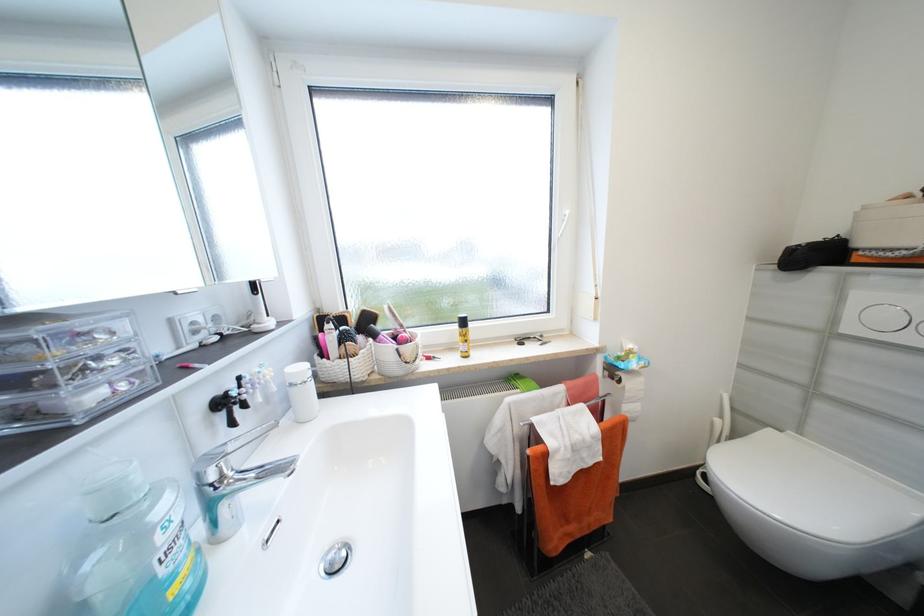
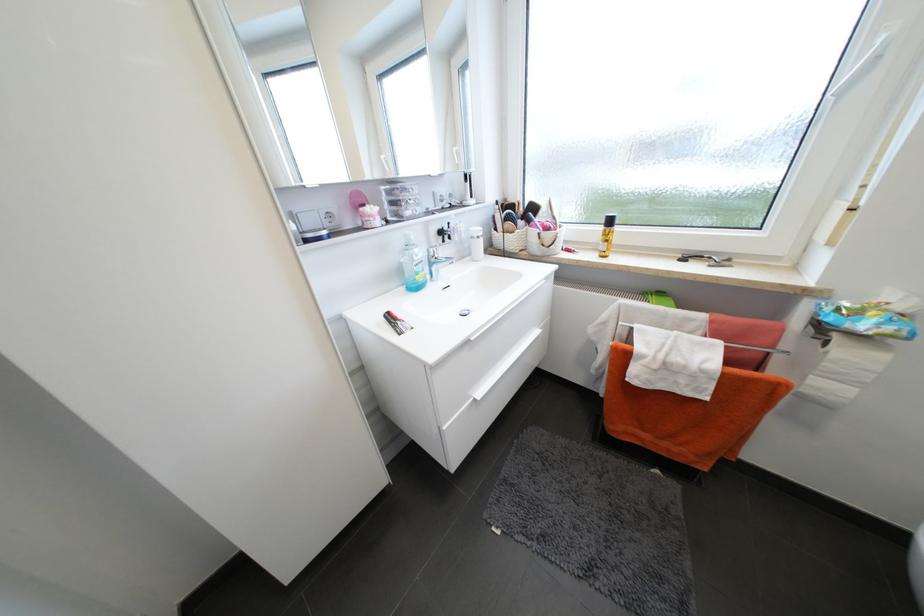
The point at (x=219, y=479) is marked in the first image. Where is the corresponding point in the second image?

(438, 254)